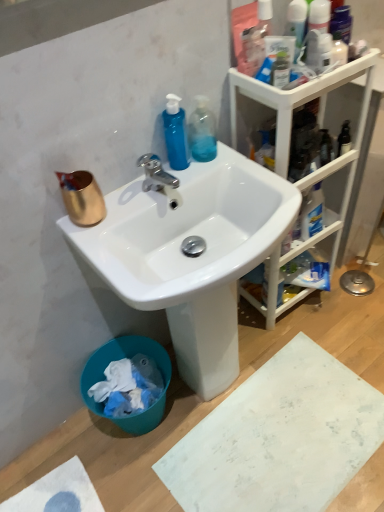
The width and height of the screenshot is (384, 512). What are the coordinates of `free space in front of copper metallic cup at upper left` in the screenshot? It's located at (97, 242).